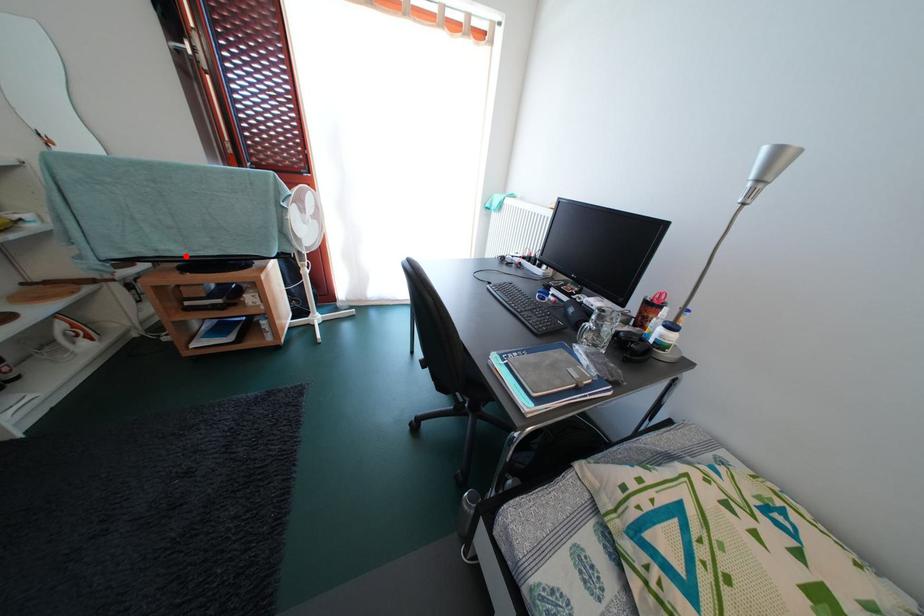
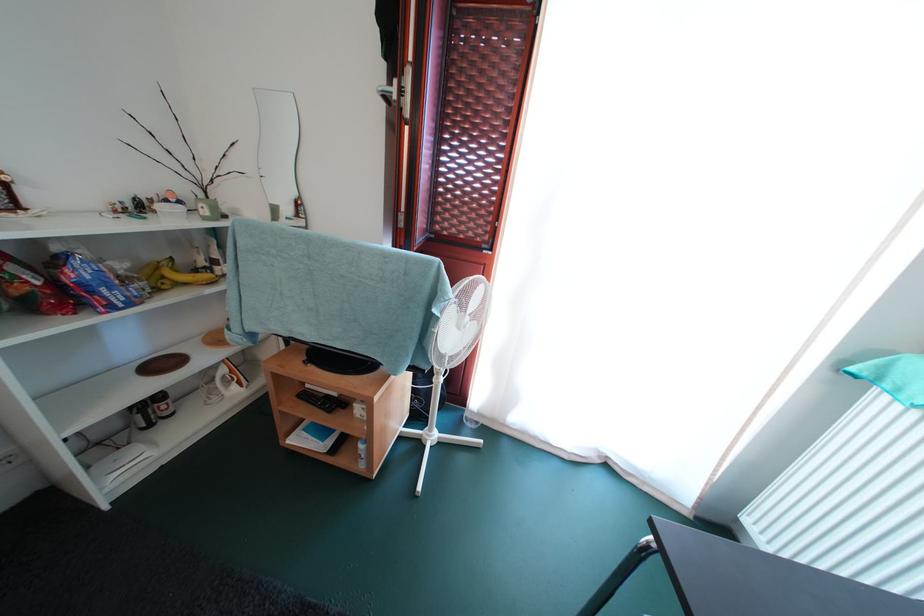
In the second image, find the point that corresponds to the highlighted location in the first image.

(318, 341)